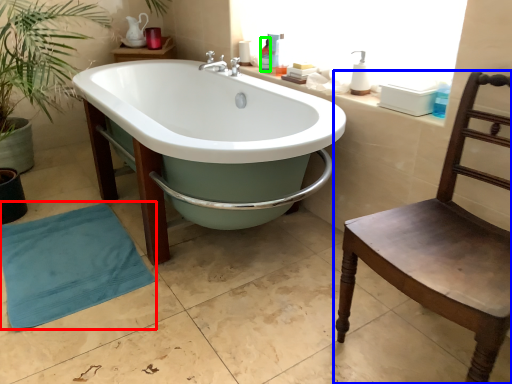
Question: Considering the real-world distances, which object is farthest from beach towel (highlighted by a red box)? chair (highlighted by a blue box) or toiletry (highlighted by a green box)?

Choices:
 (A) chair
 (B) toiletry

Answer: (B)